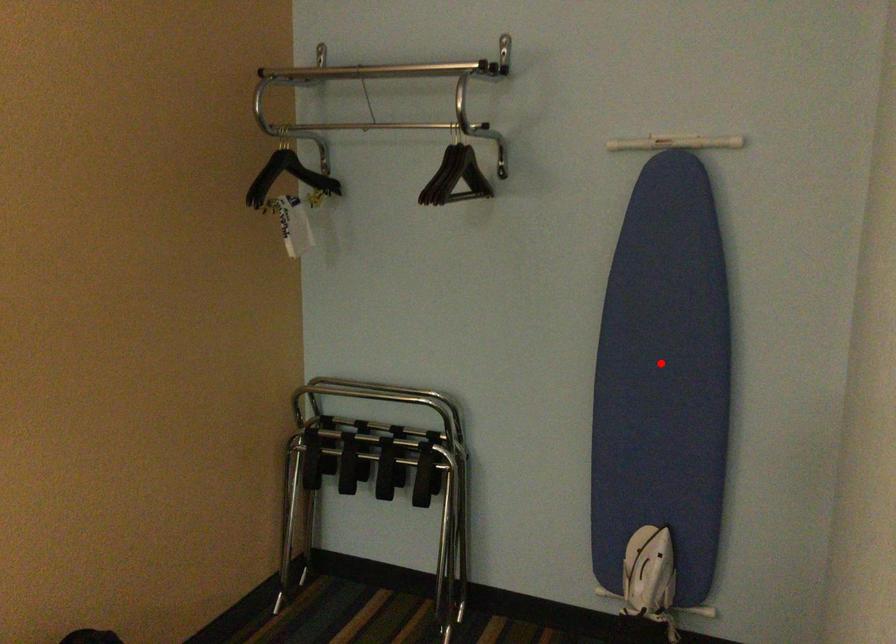
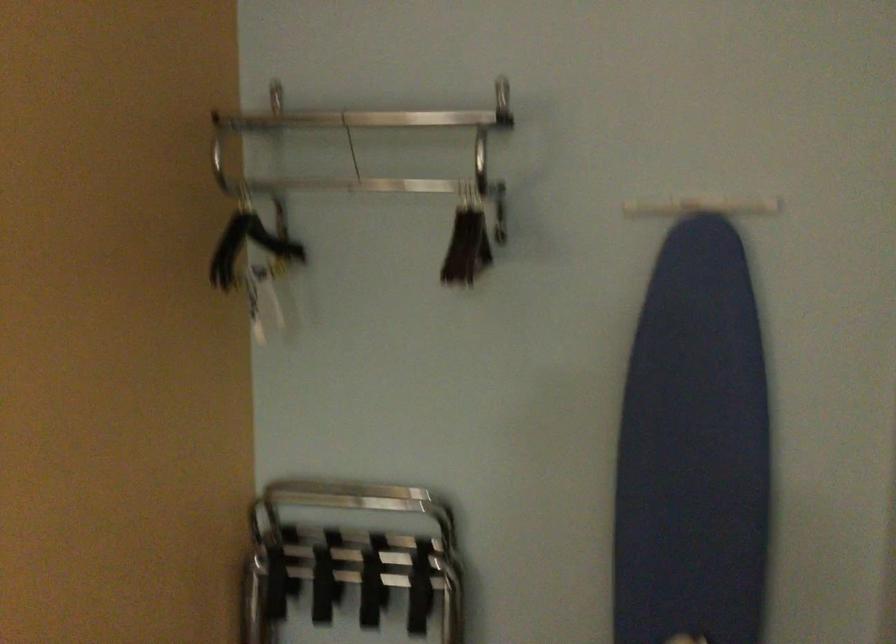
In the second image, find the point that corresponds to the highlighted location in the first image.

(694, 449)